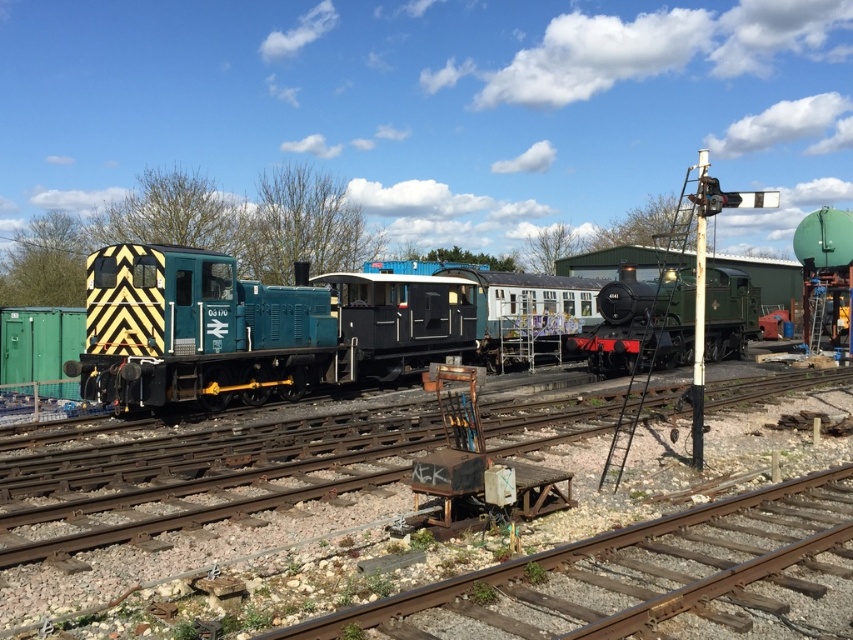
Does teal painted metal locomotive at center appear over teal matte locomotive at left?

No.

Can you confirm if teal painted metal locomotive at center is thinner than teal matte locomotive at left?

No.

Find the location of `teal painted metal locomotive at center`. teal painted metal locomotive at center is located at coordinates (254, 328).

Find the location of a particular element. teal painted metal locomotive at center is located at coordinates (254, 328).

Measure the distance from rusty metal train track at lower center to green polished wood steam locomotive at center.

rusty metal train track at lower center is 67.50 feet from green polished wood steam locomotive at center.

Which is below, rusty metal train track at lower center or green polished wood steam locomotive at center?

rusty metal train track at lower center

Which is behind, point (590, 621) or point (631, 358)?

The point (631, 358) is behind.

The height and width of the screenshot is (640, 853). I want to click on rusty metal train track at lower center, so click(631, 573).

Can you confirm if teal painted metal locomotive at center is positioned to the left of rusty metal train track at lower center?

Yes, teal painted metal locomotive at center is to the left of rusty metal train track at lower center.

The image size is (853, 640). What do you see at coordinates (254, 328) in the screenshot?
I see `teal painted metal locomotive at center` at bounding box center [254, 328].

This screenshot has width=853, height=640. Identify the location of teal painted metal locomotive at center. (254, 328).